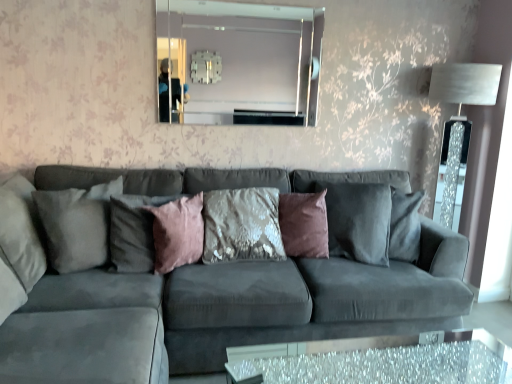
Question: Does suede gray couch at center have a greater height compared to velvet pink pillow at center, the third pillow when ordered from left to right?

Choices:
 (A) no
 (B) yes

Answer: (B)

Question: From the image's perspective, would you say suede gray couch at center is positioned over velvet pink pillow at center, the third pillow when ordered from left to right?

Choices:
 (A) yes
 (B) no

Answer: (B)

Question: From a real-world perspective, is suede gray couch at center beneath velvet pink pillow at center, the third pillow when ordered from left to right?

Choices:
 (A) yes
 (B) no

Answer: (A)

Question: Does suede gray couch at center have a greater width compared to velvet pink pillow at center, marked as the 2th pillow in a right-to-left arrangement?

Choices:
 (A) no
 (B) yes

Answer: (B)

Question: Is suede gray couch at center to the right of velvet pink pillow at center, the third pillow when ordered from left to right, from the viewer's perspective?

Choices:
 (A) yes
 (B) no

Answer: (A)

Question: Does suede gray couch at center contain velvet pink pillow at center, marked as the 2th pillow in a right-to-left arrangement?

Choices:
 (A) no
 (B) yes

Answer: (B)

Question: Does clear glass mirror at upper center have a lesser height compared to sparkly glass table at lower center?

Choices:
 (A) no
 (B) yes

Answer: (A)

Question: Considering the relative sizes of clear glass mirror at upper center and sparkly glass table at lower center in the image provided, is clear glass mirror at upper center thinner than sparkly glass table at lower center?

Choices:
 (A) no
 (B) yes

Answer: (B)

Question: Can you see clear glass mirror at upper center touching sparkly glass table at lower center?

Choices:
 (A) no
 (B) yes

Answer: (A)

Question: Can sparkly glass table at lower center be found inside clear glass mirror at upper center?

Choices:
 (A) no
 (B) yes

Answer: (A)

Question: From a real-world perspective, is clear glass mirror at upper center physically below sparkly glass table at lower center?

Choices:
 (A) no
 (B) yes

Answer: (A)

Question: Is clear glass mirror at upper center to the left of sparkly glass table at lower center from the viewer's perspective?

Choices:
 (A) yes
 (B) no

Answer: (A)

Question: From a real-world perspective, does suede gray pillow at left, the fourth pillow viewed from the right, sit lower than clear glass mirror at upper center?

Choices:
 (A) yes
 (B) no

Answer: (A)